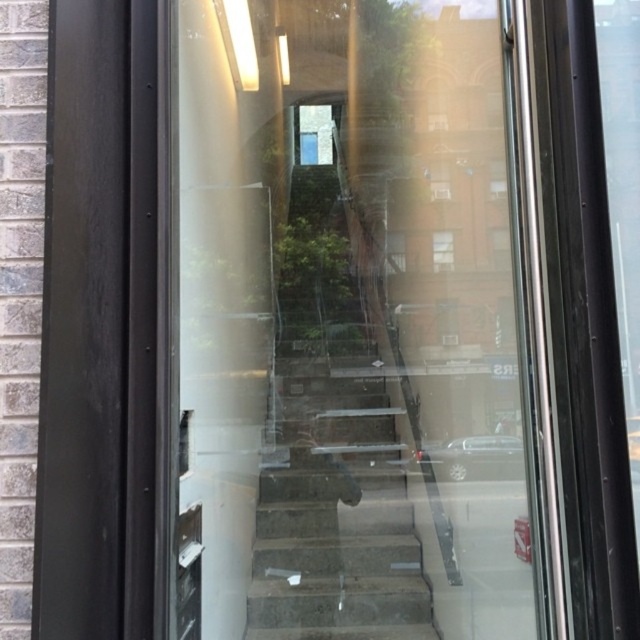
Question: Which point appears closest to the camera in this image?

Choices:
 (A) (392, 412)
 (B) (512, 525)
 (C) (442, 253)

Answer: (B)

Question: Does transparent glass door at center have a greater width compared to concrete stairs at center?

Choices:
 (A) no
 (B) yes

Answer: (B)

Question: Is transparent glass door at center below concrete stairs at center?

Choices:
 (A) no
 (B) yes

Answer: (A)

Question: Is transparent glass door at center positioned behind transparent glass window at center?

Choices:
 (A) no
 (B) yes

Answer: (A)

Question: Which point is closer to the camera taking this photo?

Choices:
 (A) (333, 604)
 (B) (452, 237)

Answer: (A)

Question: Estimate the real-world distances between objects in this image. Which object is farther from the transparent glass window at center?

Choices:
 (A) concrete stairs at center
 (B) clear glass window at center
 (C) transparent glass door at center

Answer: (A)